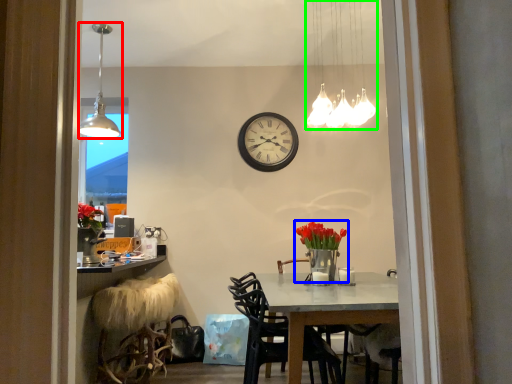
Question: Considering the real-world distances, which object is farthest from lamp (highlighted by a red box)? floral arrangement (highlighted by a blue box) or lamp (highlighted by a green box)?

Choices:
 (A) floral arrangement
 (B) lamp

Answer: (A)